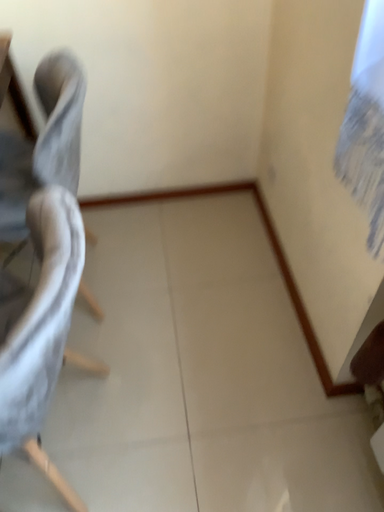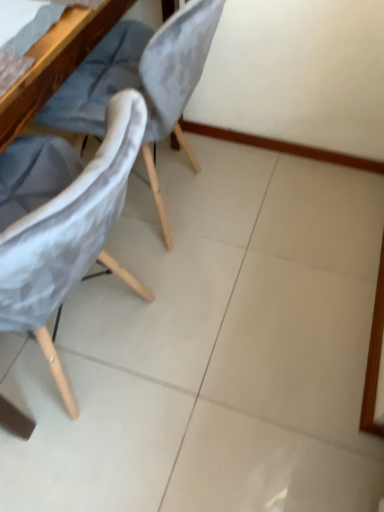
Question: Which way did the camera rotate in the video?

Choices:
 (A) rotated left
 (B) rotated right

Answer: (A)